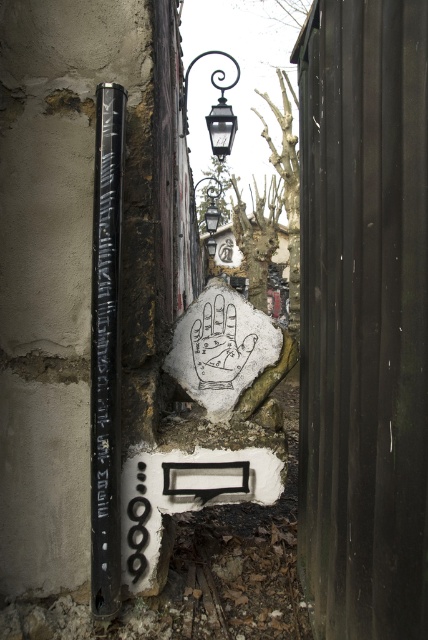
You are a delivery person trying to locate the correct alleyway address. You see a weathered wall with graffiti and a mailbox slot below a rock hand illustration. There is also a black polished metal pole at left. According to the scene description, which object is located at the coordinates point [106,353]?

The black polished metal pole at left is located at point [106,353].

In the scene shown: You are a delivery person trying to locate the correct alleyway address. You see the black polished metal pole at left and the polished metal streetlamp at upper center. Which object is positioned further to the east? Please answer based on the scene description.

The black polished metal pole at left is to the left of polished metal streetlamp at upper center, so the black polished metal pole at left is positioned further to the east.

You are a delivery person trying to locate a specific address in this alleyway. You see the black polished metal pole at left and the polished metal streetlamp at upper center. According to the scene, which object is directly above the other?

The polished metal streetlamp at upper center is directly above the black polished metal pole at left because the black polished metal pole at left is positioned under the polished metal streetlamp at upper center.